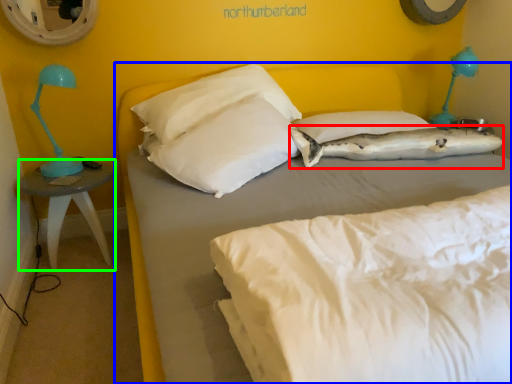
Question: Which is nearer to the pillow (highlighted by a red box)? bed (highlighted by a blue box) or nightstand (highlighted by a green box).

Choices:
 (A) bed
 (B) nightstand

Answer: (A)